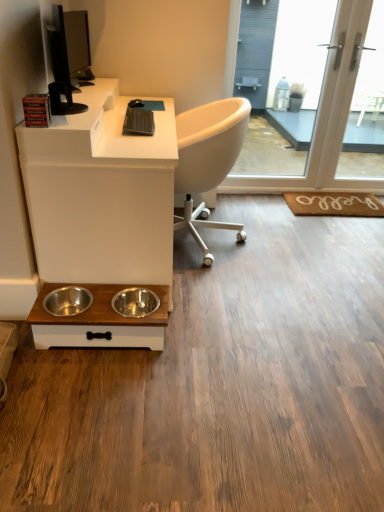
The height and width of the screenshot is (512, 384). Find the location of `free space in front of white matte desk at lower left`. free space in front of white matte desk at lower left is located at coordinates (166, 380).